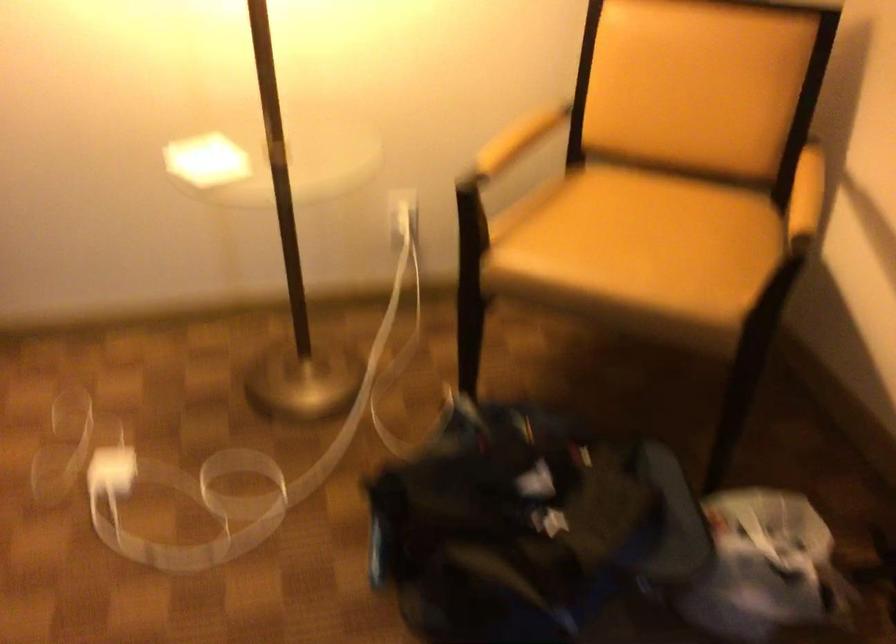
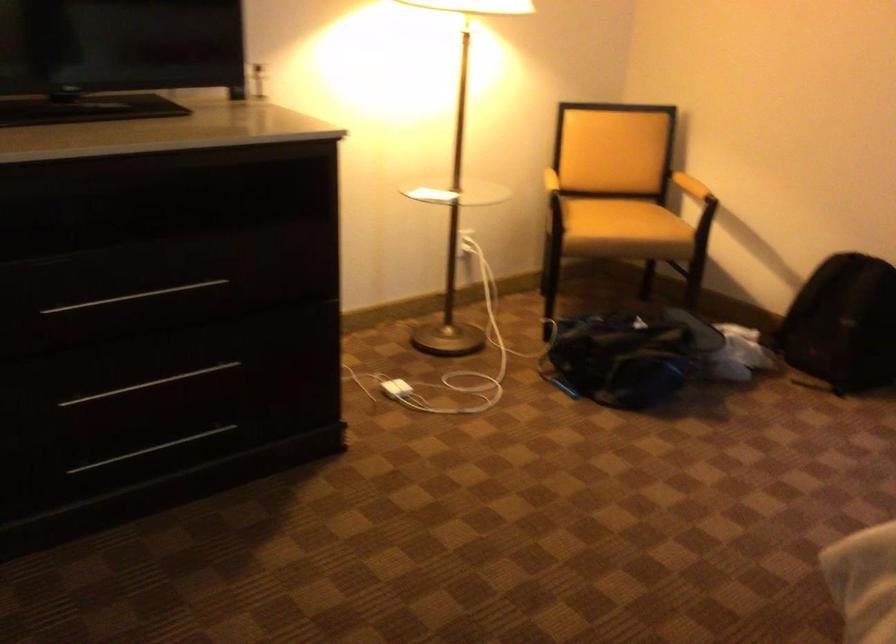
Where in the second image is the point corresponding to (x=474, y=556) from the first image?

(627, 355)